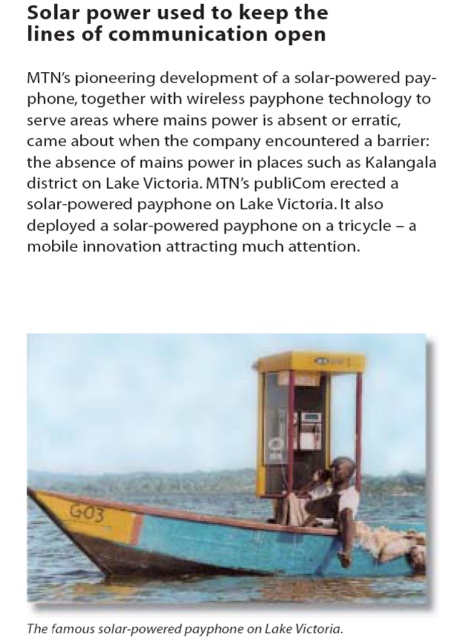
You are a tourist visiting Lake Victoria and see the white matte shirt at center and the yellow plastic phone box at center on the boat. Which object takes up more space in the image?

The white matte shirt at center is bigger than the yellow plastic phone box at center, so it takes up more space in the image.

You are a fisherman who needs to board the yellow painted wood boat at center. You are currently standing on the dock and see the white matte shirt at center on the boat. Can you tell if the boat has enough space to accommodate your fishing gear along with the shirt?

The yellow painted wood boat at center might be wider than the white matte shirt at center, so there could be enough space to accommodate your fishing gear along with the shirt.

You are standing on the dock and see a person wearing a white matte shirt at center. If you want to throw a frisbee to them, will it reach them?

The distance between you and the white matte shirt at center is 22.62 meters. A typical frisbee throw can reach up to around 30 meters, so yes, it should reach them if thrown accurately.